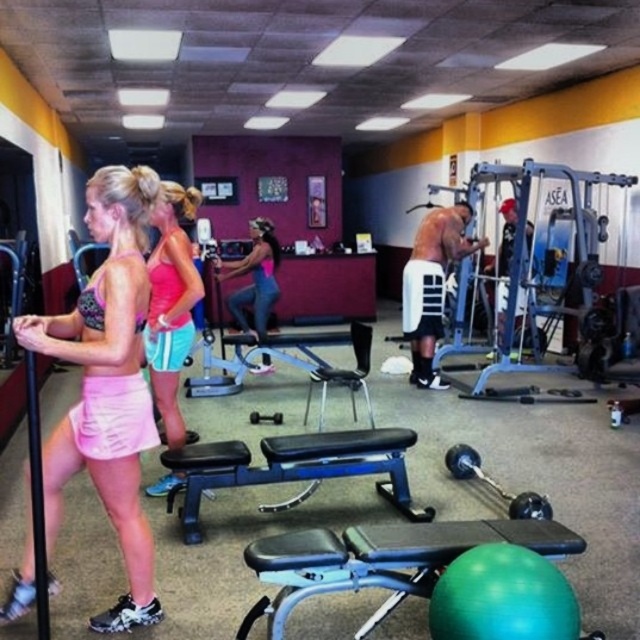
Question: Does pink fabric leggings at center have a smaller size compared to black rubber dumbbell at center?

Choices:
 (A) no
 (B) yes

Answer: (A)

Question: Is pink fabric shorts at center bigger than black rubber dumbbell at center?

Choices:
 (A) no
 (B) yes

Answer: (B)

Question: Which object appears closest to the camera in this image?

Choices:
 (A) black rubber dumbbell at center
 (B) pink fabric shorts at left
 (C) shiny white padded arm guard at center
 (D) pink fabric leggings at center

Answer: (B)

Question: Among these points, which one is nearest to the camera?

Choices:
 (A) click(x=454, y=216)
 (B) click(x=35, y=332)
 (C) click(x=282, y=506)

Answer: (B)

Question: Among these points, which one is farthest from the camera?

Choices:
 (A) (436, 276)
 (B) (116, 476)
 (C) (243, 465)

Answer: (A)

Question: Does pink fabric shorts at left appear on the left side of shiny white padded arm guard at center?

Choices:
 (A) no
 (B) yes

Answer: (B)